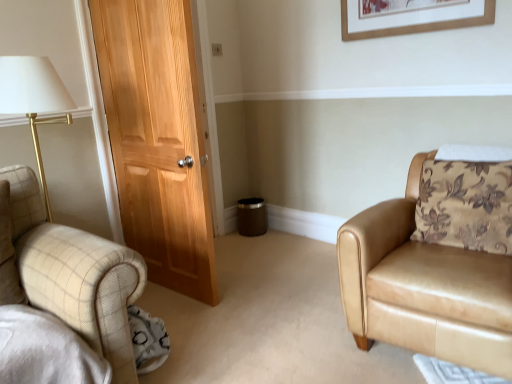
The image size is (512, 384). I want to click on vacant space situated on the left part of tan leather armchair at right, so click(281, 317).